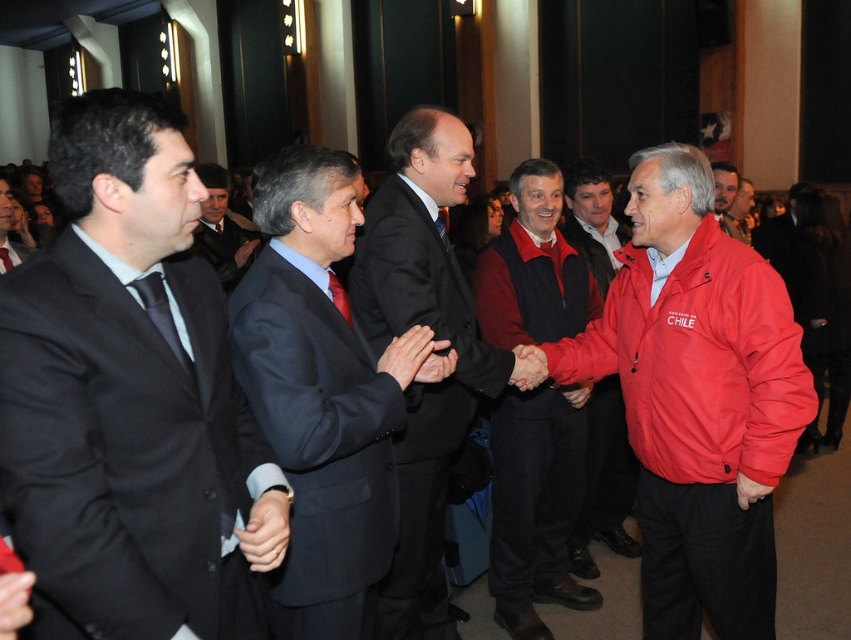
Question: Does dark blue suit at center have a smaller size compared to red matte jacket at center?

Choices:
 (A) no
 (B) yes

Answer: (A)

Question: Which object appears farthest from the camera in this image?

Choices:
 (A) matte black suit at center
 (B) dark gray suit at center
 (C) dark suit at center
 (D) dark blue suit at center

Answer: (A)

Question: Does black suit at center have a greater width compared to red fleece jacket at center?

Choices:
 (A) yes
 (B) no

Answer: (B)

Question: Which object appears closest to the camera in this image?

Choices:
 (A) dark gray suit at center
 (B) red fleece jacket at center
 (C) black suit at center
 (D) matte black suit at center

Answer: (C)

Question: Is matte red jacket at center positioned at the back of red matte jacket at center?

Choices:
 (A) no
 (B) yes

Answer: (A)

Question: Among these objects, which one is nearest to the camera?

Choices:
 (A) dark gray suit at center
 (B) black suit at center
 (C) red matte jacket at center

Answer: (B)